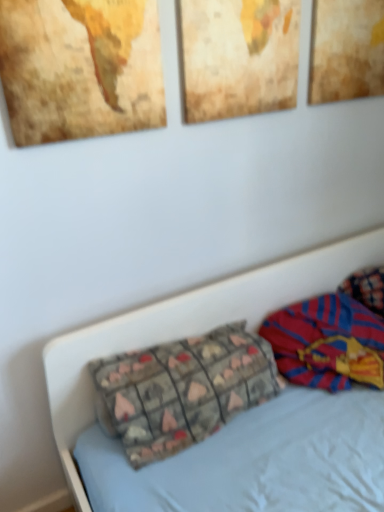
Question: Is textured fabric pillow at center to the left or to the right of wooden textured picture frame at upper center, placed as the 2th picture frame when sorted from right to left, in the image?

Choices:
 (A) right
 (B) left

Answer: (B)

Question: Is textured fabric pillow at center inside or outside of wooden textured picture frame at upper center, placed as the 2th picture frame when sorted from right to left?

Choices:
 (A) outside
 (B) inside

Answer: (A)

Question: Which is farther from the textured fabric pillow at center?

Choices:
 (A) textured paper picture frame at upper right, which is the third picture frame in left-to-right order
 (B) wooden map at upper left, which appears as the 3th picture frame when viewed from the right
 (C) striped fabric blanket at right
 (D) wooden textured picture frame at upper center, placed as the 2th picture frame when sorted from right to left

Answer: (A)

Question: Which object is the farthest from the textured paper picture frame at upper right, which is the third picture frame in left-to-right order?

Choices:
 (A) wooden textured picture frame at upper center, placed as the 2th picture frame when sorted from left to right
 (B) wooden map at upper left, which appears as the 3th picture frame when viewed from the right
 (C) textured fabric pillow at center
 (D) striped fabric blanket at right

Answer: (C)